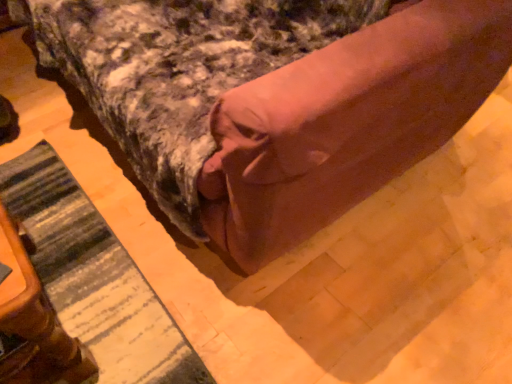
In order to face brown fabric bed at center, should I rotate leftwards or rightwards?

Turn left by 9.428 degrees to look at brown fabric bed at center.

You are a GUI agent. You are given a task and a screenshot of the screen. Output one action in this format:
    pyautogui.click(x=<x>, y=<y>)
    Task: Click on the wooden table at lower left
    The width and height of the screenshot is (512, 384).
    Given the screenshot: What is the action you would take?
    34,324

From a real-world perspective, who is located lower, striped fabric mat at lower left or brown fabric bed at center?

striped fabric mat at lower left, from a real-world perspective.

Can you confirm if striped fabric mat at lower left is smaller than brown fabric bed at center?

Correct, striped fabric mat at lower left occupies less space than brown fabric bed at center.

Does striped fabric mat at lower left lie in front of brown fabric bed at center?

No, it is behind brown fabric bed at center.

In the scene shown: From the image's perspective, is brown fabric bed at center above wooden table at lower left?

Yes, from the image's perspective, brown fabric bed at center is over wooden table at lower left.

Is brown fabric bed at center taller than wooden table at lower left?

Yes, brown fabric bed at center is taller than wooden table at lower left.

Can you tell me how much brown fabric bed at center and wooden table at lower left differ in facing direction?

They differ by 0.253 degrees in their facing directions.

At what (x,y) coordinates should I click in order to perform the action: click on furniture that is below the brown fabric bed at center (from the image's perspective). Please return your answer as a coordinate pair (x, y). The width and height of the screenshot is (512, 384). Looking at the image, I should click on tap(34, 324).

How much distance is there between wooden table at lower left and striped fabric mat at lower left?

They are 10.83 inches apart.

Is wooden table at lower left facing away from striped fabric mat at lower left?

That's not correct — wooden table at lower left is not looking away from striped fabric mat at lower left.

Which of these two, wooden table at lower left or striped fabric mat at lower left, is thinner?

wooden table at lower left.

Which is in front, point (50, 272) or point (87, 365)?

The point (87, 365) is closer to the camera.

Is striped fabric mat at lower left oriented towards wooden table at lower left?

Yes, striped fabric mat at lower left is turned towards wooden table at lower left.

Visually, is striped fabric mat at lower left positioned to the left or to the right of wooden table at lower left?

Clearly, striped fabric mat at lower left is on the right of wooden table at lower left in the image.

From a real-world perspective, does striped fabric mat at lower left stand above wooden table at lower left?

No, from a real-world perspective, striped fabric mat at lower left is not over wooden table at lower left

Is wooden table at lower left far from brown fabric bed at center?

Actually, wooden table at lower left and brown fabric bed at center are a little close together.

Does wooden table at lower left turn towards brown fabric bed at center?

No, wooden table at lower left does not turn towards brown fabric bed at center.

From a real-world perspective, is wooden table at lower left physically located above or below brown fabric bed at center?

wooden table at lower left is situated lower than brown fabric bed at center in the real world.

Between point (39, 356) and point (366, 107), which one is positioned behind?

The point (39, 356) is behind.

Locate an element on the screen. bed in front of the striped fabric mat at lower left is located at coordinates 346,122.

From a real-world perspective, who is located lower, brown fabric bed at center or striped fabric mat at lower left?

striped fabric mat at lower left is physically lower.

Based on the photo, is brown fabric bed at center thinner than striped fabric mat at lower left?

No.

Image resolution: width=512 pixels, height=384 pixels. In order to click on mat below the brown fabric bed at center (from the image's perspective) in this screenshot , I will do `click(94, 277)`.

Image resolution: width=512 pixels, height=384 pixels. Find the location of `furniture lying behind the brown fabric bed at center`. furniture lying behind the brown fabric bed at center is located at coordinates (34, 324).

From the image, which object appears to be nearer to striped fabric mat at lower left, brown fabric bed at center or wooden table at lower left?

wooden table at lower left lies closer to striped fabric mat at lower left than the other object.

Based on their spatial positions, is striped fabric mat at lower left or wooden table at lower left further from brown fabric bed at center?

wooden table at lower left.

Which object lies further to the anchor point wooden table at lower left, brown fabric bed at center or striped fabric mat at lower left?

brown fabric bed at center is further to wooden table at lower left.

From the image, which object appears to be farther from wooden table at lower left, striped fabric mat at lower left or brown fabric bed at center?

Among the two, brown fabric bed at center is located further to wooden table at lower left.

Based on their spatial positions, is wooden table at lower left or striped fabric mat at lower left further from brown fabric bed at center?

wooden table at lower left is further to brown fabric bed at center.

Considering their positions, is wooden table at lower left positioned further to striped fabric mat at lower left than brown fabric bed at center?

brown fabric bed at center is positioned further to the anchor striped fabric mat at lower left.

Find the location of a particular element. furniture between brown fabric bed at center and striped fabric mat at lower left vertically is located at coordinates (34, 324).